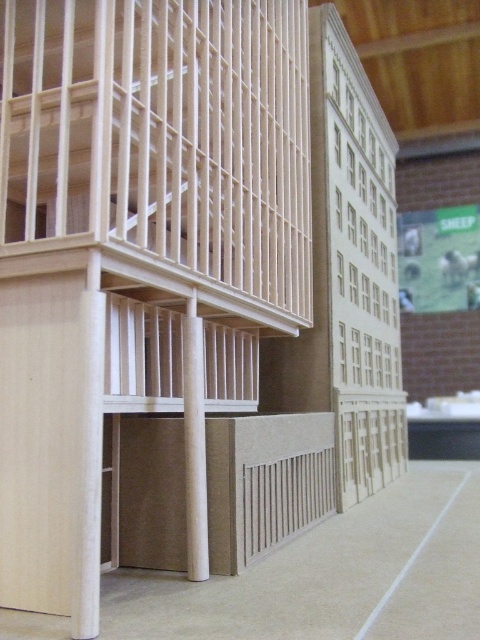
Who is higher up, light wood bunk bed at left or matte wood pillar at center?

light wood bunk bed at left is higher up.

Is light wood bunk bed at left to the left of matte wood pillar at center from the viewer's perspective?

Indeed, light wood bunk bed at left is positioned on the left side of matte wood pillar at center.

The height and width of the screenshot is (640, 480). I want to click on light wood bunk bed at left, so click(135, 244).